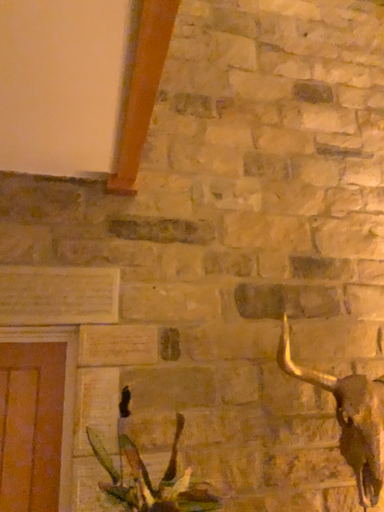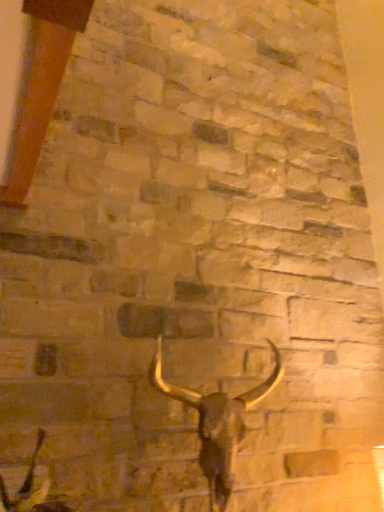
Question: Which way did the camera rotate in the video?

Choices:
 (A) rotated left
 (B) rotated right

Answer: (B)